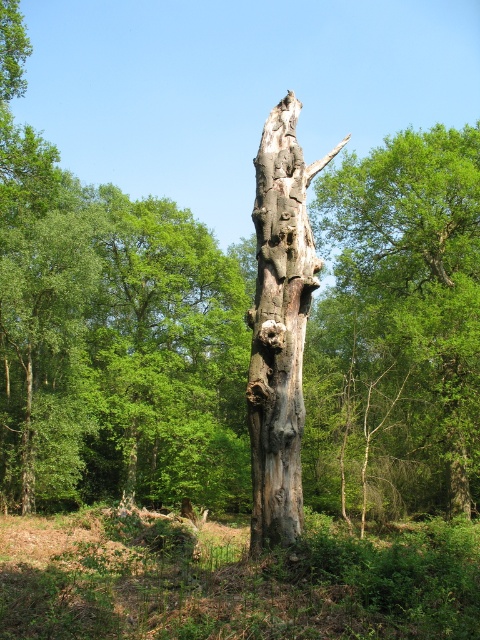
Based on the photo, you are a hiker who has stumbled upon a forest scene with a prominent tree. You notice coordinates marked at point [397,330]. What does this coordinate point indicate?

The point [397,330] indicates the location of the gray rough bark tree at center.

You are standing in the forest and want to find the gray rough bark tree at center. Based on its 2D coordinates, in which direction should you move relative to your current position at point 0,0?

The gray rough bark tree at center is located at coordinates (x=397, y=330). Since you are at (x=0, y=0), you should move northeast to reach it.